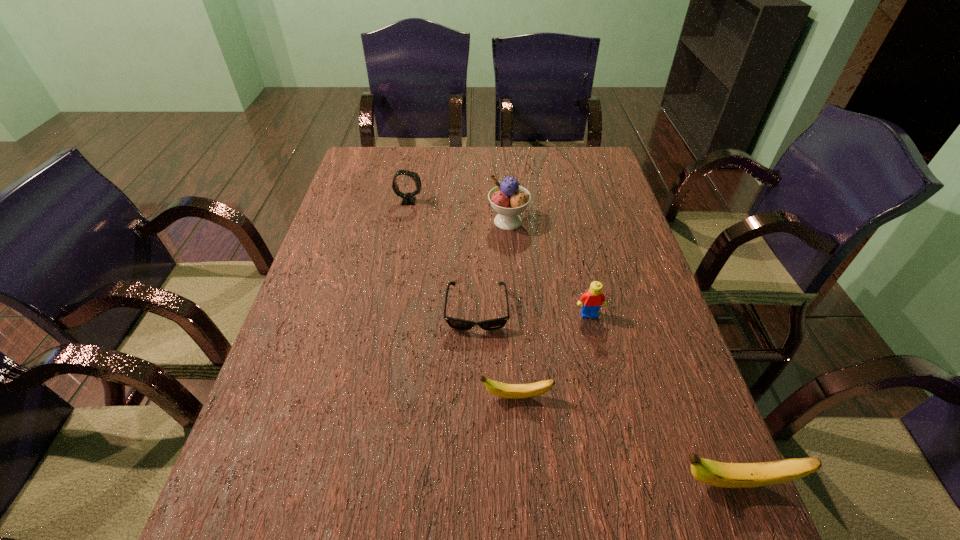
Where is `object situated at the near edge`? Image resolution: width=960 pixels, height=540 pixels. object situated at the near edge is located at coordinates pos(724,475).

The height and width of the screenshot is (540, 960). I want to click on banana that is positioned at the right edge, so click(x=724, y=475).

You are a GUI agent. You are given a task and a screenshot of the screen. Output one action in this format:
    pyautogui.click(x=<x>, y=<y>)
    Task: Click on the Lego that is at the right edge
    
    Given the screenshot: What is the action you would take?
    pyautogui.click(x=591, y=301)

At what (x,y) coordinates should I click in order to perform the action: click on object at the near right corner. Please return your answer as a coordinate pair (x, y). This screenshot has width=960, height=540. Looking at the image, I should click on (724, 475).

At what (x,y) coordinates should I click in order to perform the action: click on free location at the far edge of the desktop. Please return your answer as a coordinate pair (x, y). This screenshot has height=540, width=960. Looking at the image, I should click on (461, 160).

This screenshot has height=540, width=960. In the image, there is a desktop. In order to click on free region at the near edge in this screenshot , I will do tap(578, 482).

The height and width of the screenshot is (540, 960). In the image, there is a desktop. In order to click on vacant space at the left edge in this screenshot , I will do `click(270, 427)`.

The image size is (960, 540). I want to click on vacant region at the right edge of the desktop, so click(579, 224).

You are a GUI agent. You are given a task and a screenshot of the screen. Output one action in this format:
    pyautogui.click(x=<x>, y=<y>)
    Task: Click on the free region at the far left corner of the desktop
    The height and width of the screenshot is (540, 960).
    Given the screenshot: What is the action you would take?
    pyautogui.click(x=376, y=181)

The height and width of the screenshot is (540, 960). In the image, there is a desktop. Find the location of `vacant area at the far right corner`. vacant area at the far right corner is located at coordinates (593, 153).